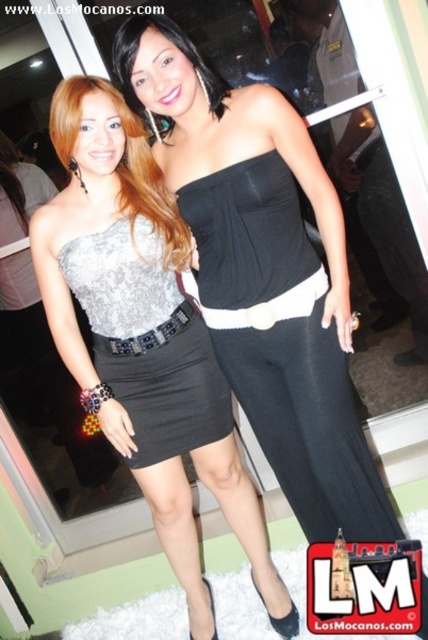
You are standing in front of the image and want to locate the silver sequined dress at left. What are the coordinates of its position?

The silver sequined dress at left is located at coordinates point (142,333).

You are at a fashion show and need to decide which dress to recommend based on height. The black satin strapless dress at center and the matte black dress at center are both on display. Which dress is taller?

The black satin strapless dress at center is taller than the matte black dress at center according to the description.